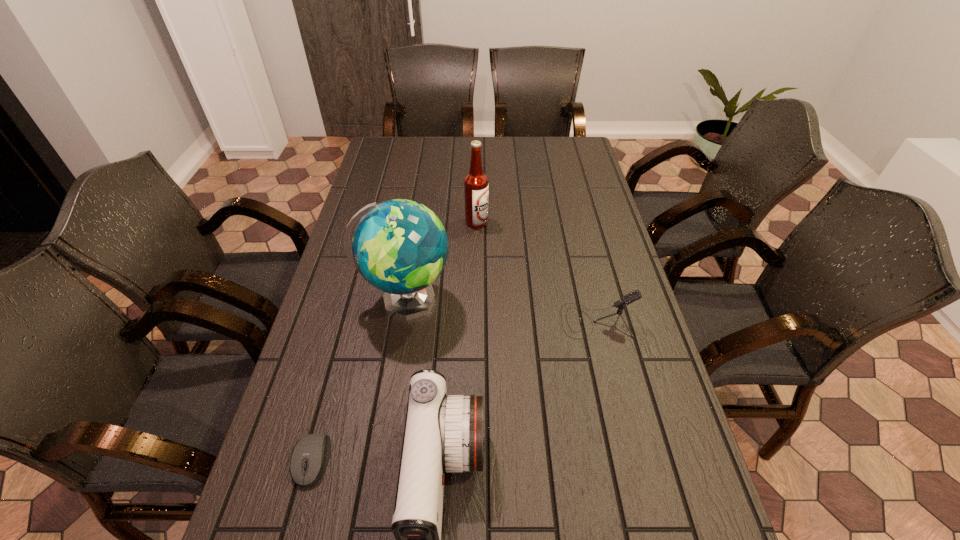
Locate an element on the screen. free point between the microphone and the globe is located at coordinates (501, 310).

Image resolution: width=960 pixels, height=540 pixels. I want to click on free space between the computer equipment and the alcohol, so (395, 341).

This screenshot has width=960, height=540. Find the location of `free space between the computer equipment and the farthest object`. free space between the computer equipment and the farthest object is located at coordinates (395, 341).

You are a GUI agent. You are given a task and a screenshot of the screen. Output one action in this format:
    pyautogui.click(x=<x>, y=<y>)
    Task: Click on the blank region between the shortest object and the farthest object
    
    Given the screenshot: What is the action you would take?
    pyautogui.click(x=395, y=341)

Select which object appears as the third closest to the computer equipment. Please provide its 2D coordinates. Your answer should be formatted as a tuple, i.e. [(x, y)], where the tuple contains the x and y coordinates of a point satisfying the conditions above.

[(635, 295)]

Select which object is the fourth closest to the computer equipment. Please provide its 2D coordinates. Your answer should be formatted as a tuple, i.e. [(x, y)], where the tuple contains the x and y coordinates of a point satisfying the conditions above.

[(476, 186)]

Find the location of a particular element. blank space that satisfies the following two spatial constraints: 1. on the front surface of the globe; 2. on the front side of the computer equipment is located at coordinates (380, 461).